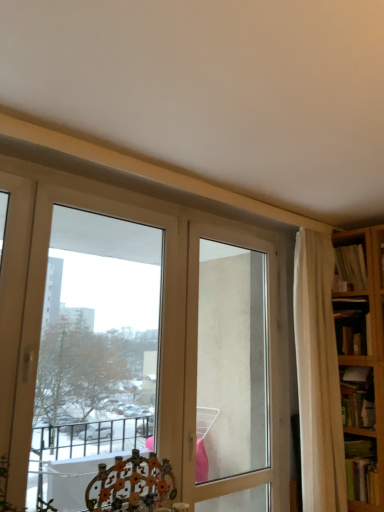
Question: Would you consider hardcover book at lower right, the first book when ordered from bottom to top, to be distant from hardcover book at right, the 2th book from the bottom?

Choices:
 (A) no
 (B) yes

Answer: (A)

Question: Is hardcover book at lower right, which is the fourth book in top-to-bottom order, taller than hardcover book at right, the 2th book from the bottom?

Choices:
 (A) no
 (B) yes

Answer: (A)

Question: Is hardcover book at lower right, which is the fourth book in top-to-bottom order, further to camera compared to hardcover book at right, the 2th book from the bottom?

Choices:
 (A) no
 (B) yes

Answer: (A)

Question: Is hardcover book at lower right, which is the fourth book in top-to-bottom order, completely or partially outside of hardcover book at right, the 2th book from the bottom?

Choices:
 (A) no
 (B) yes

Answer: (B)

Question: From a real-world perspective, is hardcover book at lower right, the first book when ordered from bottom to top, under hardcover book at right, the 2th book from the bottom?

Choices:
 (A) no
 (B) yes

Answer: (B)

Question: Is hardcover book at lower right, the first book when ordered from bottom to top, facing towards hardcover book at right, the 3th book when ordered from top to bottom?

Choices:
 (A) yes
 (B) no

Answer: (B)

Question: Is transparent glass screen door at center to the right of hardcover book at right, which appears as the 1th book when viewed from the top, from the viewer's perspective?

Choices:
 (A) no
 (B) yes

Answer: (A)

Question: Considering the relative sizes of transparent glass screen door at center and hardcover book at right, which appears as the fourth book when ordered from the bottom, in the image provided, is transparent glass screen door at center shorter than hardcover book at right, which appears as the fourth book when ordered from the bottom,?

Choices:
 (A) yes
 (B) no

Answer: (B)

Question: Is transparent glass screen door at center facing towards hardcover book at right, which appears as the 1th book when viewed from the top?

Choices:
 (A) yes
 (B) no

Answer: (B)

Question: Does transparent glass screen door at center have a lesser width compared to hardcover book at right, which appears as the 1th book when viewed from the top?

Choices:
 (A) yes
 (B) no

Answer: (A)

Question: Are transparent glass screen door at center and hardcover book at right, which appears as the 1th book when viewed from the top, far apart?

Choices:
 (A) no
 (B) yes

Answer: (B)

Question: Does transparent glass screen door at center come in front of hardcover book at right, which appears as the fourth book when ordered from the bottom?

Choices:
 (A) no
 (B) yes

Answer: (B)

Question: Could you tell me if hardcover book at lower right, the first book when ordered from bottom to top, is turned towards wooden bookshelf at right, which appears as the 3th book when ordered from the bottom?

Choices:
 (A) yes
 (B) no

Answer: (B)